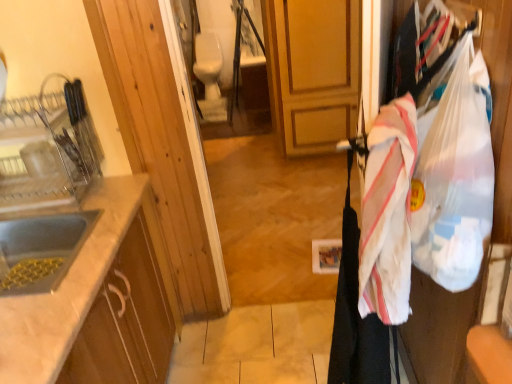
How much space does matte silver sink at left, which is counted as the 1th sink, starting from the top, occupy horizontally?

10.99 inches.

Locate an element on the screen. white marble countertop at left is located at coordinates (67, 290).

You are a GUI agent. You are given a task and a screenshot of the screen. Output one action in this format:
    pyautogui.click(x=<x>, y=<y>)
    Task: Click on the translucent plastic grocery bag at right
    
    Given the screenshot: What is the action you would take?
    pyautogui.click(x=454, y=176)

Can you confirm if matte silver sink at left, the 2th sink in the bottom-to-top sequence, is taller than translucent plastic grocery bag at right?

Incorrect, the height of matte silver sink at left, the 2th sink in the bottom-to-top sequence, is not larger of that of translucent plastic grocery bag at right.

Can you confirm if matte silver sink at left, the 2th sink in the bottom-to-top sequence, is positioned to the right of translucent plastic grocery bag at right?

In fact, matte silver sink at left, the 2th sink in the bottom-to-top sequence, is to the left of translucent plastic grocery bag at right.

There is a matte silver sink at left, the 2th sink in the bottom-to-top sequence. Where is `grocery bag above it (from a real-world perspective)`? The image size is (512, 384). grocery bag above it (from a real-world perspective) is located at coordinates (454, 176).

Is point (383, 160) farther from viewer compared to point (481, 206)?

Yes, point (383, 160) is behind point (481, 206).

Is white striped fabric at right not inside translucent plastic grocery bag at right?

Yes.

From a real-world perspective, which object rests below the other?

In real-world perspective, white striped fabric at right is lower.

In the image, is white striped fabric at right positioned in front of or behind translucent plastic grocery bag at right?

white striped fabric at right is positioned farther from the viewer than translucent plastic grocery bag at right.

Considering the sizes of objects white matte sink at left, the 1th sink positioned from the bottom, and white marble countertop at left in the image provided, who is bigger, white matte sink at left, the 1th sink positioned from the bottom, or white marble countertop at left?

With larger size is white marble countertop at left.

From a real-world perspective, is white matte sink at left, the 1th sink positioned from the bottom, above or below white marble countertop at left?

From a real-world perspective, white matte sink at left, the 1th sink positioned from the bottom, is physically above white marble countertop at left.

Measure the distance from white matte sink at left, the 1th sink positioned from the bottom, to white marble countertop at left.

white matte sink at left, the 1th sink positioned from the bottom, is 6.45 inches away from white marble countertop at left.

Is the surface of white matte sink at left, the 1th sink positioned from the bottom, in direct contact with white marble countertop at left?

No, white matte sink at left, the 1th sink positioned from the bottom, is not with white marble countertop at left.

Is white matte sink at left, the 1th sink positioned from the bottom, looking in the opposite direction of matte silver sink at left, the 2th sink in the bottom-to-top sequence?

No, white matte sink at left, the 1th sink positioned from the bottom, is not facing the opposite direction of matte silver sink at left, the 2th sink in the bottom-to-top sequence.

Between white matte sink at left, which is the 2th sink from top to bottom, and matte silver sink at left, which is counted as the 1th sink, starting from the top, which one appears on the right side from the viewer's perspective?

From the viewer's perspective, white matte sink at left, which is the 2th sink from top to bottom, appears more on the right side.

Considering the sizes of objects white matte sink at left, which is the 2th sink from top to bottom, and matte silver sink at left, the 2th sink in the bottom-to-top sequence, in the image provided, who is taller, white matte sink at left, which is the 2th sink from top to bottom, or matte silver sink at left, the 2th sink in the bottom-to-top sequence,?

matte silver sink at left, the 2th sink in the bottom-to-top sequence.

From a real-world perspective, who is located lower, white matte sink at left, the 1th sink positioned from the bottom, or matte silver sink at left, which is counted as the 1th sink, starting from the top?

white matte sink at left, the 1th sink positioned from the bottom, is physically lower.

Based on the photo, is white marble countertop at left at the back of white striped fabric at right?

white striped fabric at right is not turned away from white marble countertop at left.

Where is `countertop on the left of white striped fabric at right`? The width and height of the screenshot is (512, 384). countertop on the left of white striped fabric at right is located at coordinates (67, 290).

Considering the positions of point (395, 183) and point (42, 365), is point (395, 183) closer or farther from the camera than point (42, 365)?

Point (395, 183) is positioned farther from the camera compared to point (42, 365).

Is white striped fabric at right behind white marble countertop at left?

No, it is in front of white marble countertop at left.

Starting from the translucent plastic grocery bag at right, which sink is the 1st one behind? Please provide its 2D coordinates.

[(41, 250)]

Is white matte sink at left, the 1th sink positioned from the bottom, closer to the viewer compared to translucent plastic grocery bag at right?

No, white matte sink at left, the 1th sink positioned from the bottom, is further to the viewer.

How different are the orientations of white matte sink at left, which is the 2th sink from top to bottom, and translucent plastic grocery bag at right in degrees?

They differ by 176 degrees in their facing directions.

Could you tell me if white matte sink at left, which is the 2th sink from top to bottom, is turned towards translucent plastic grocery bag at right?

No, white matte sink at left, which is the 2th sink from top to bottom, is not turned towards translucent plastic grocery bag at right.

Considering the sizes of objects translucent plastic grocery bag at right and matte silver sink at left, the 2th sink in the bottom-to-top sequence, in the image provided, who is taller, translucent plastic grocery bag at right or matte silver sink at left, the 2th sink in the bottom-to-top sequence,?

translucent plastic grocery bag at right.

Would you say translucent plastic grocery bag at right is inside or outside matte silver sink at left, which is counted as the 1th sink, starting from the top?

translucent plastic grocery bag at right exists outside the volume of matte silver sink at left, which is counted as the 1th sink, starting from the top.

From the image's perspective, is translucent plastic grocery bag at right above or below matte silver sink at left, the 2th sink in the bottom-to-top sequence?

translucent plastic grocery bag at right is below matte silver sink at left, the 2th sink in the bottom-to-top sequence.

Where is `grocery bag lying on the right of matte silver sink at left, the 2th sink in the bottom-to-top sequence`? Image resolution: width=512 pixels, height=384 pixels. grocery bag lying on the right of matte silver sink at left, the 2th sink in the bottom-to-top sequence is located at coordinates (454, 176).

Locate an element on the screen. The height and width of the screenshot is (384, 512). the 2nd sink to the left when counting from the translucent plastic grocery bag at right is located at coordinates [x=47, y=152].

Find the location of a particular element. The image size is (512, 384). grocery bag above the white striped fabric at right (from the image's perspective) is located at coordinates [454, 176].

When comparing their distances from white marble countertop at left, does translucent plastic grocery bag at right or white matte sink at left, the 1th sink positioned from the bottom, seem further?

translucent plastic grocery bag at right is further to white marble countertop at left.

When comparing their distances from white striped fabric at right, does white marble countertop at left or white matte sink at left, which is the 2th sink from top to bottom, seem closer?

Among the two, white marble countertop at left is located nearer to white striped fabric at right.

Estimate the real-world distances between objects in this image. Which object is closer to translucent plastic grocery bag at right, matte silver sink at left, the 2th sink in the bottom-to-top sequence, or white matte sink at left, which is the 2th sink from top to bottom?

The object closer to translucent plastic grocery bag at right is white matte sink at left, which is the 2th sink from top to bottom.

Based on the photo, from the image, which object appears to be farther from white marble countertop at left, matte silver sink at left, which is counted as the 1th sink, starting from the top, or white striped fabric at right?

Among the two, white striped fabric at right is located further to white marble countertop at left.

When comparing their distances from white matte sink at left, which is the 2th sink from top to bottom, does translucent plastic grocery bag at right or white marble countertop at left seem further?

translucent plastic grocery bag at right.

When comparing their distances from matte silver sink at left, the 2th sink in the bottom-to-top sequence, does translucent plastic grocery bag at right or white striped fabric at right seem further?

translucent plastic grocery bag at right.

When comparing their distances from matte silver sink at left, which is counted as the 1th sink, starting from the top, does white striped fabric at right or translucent plastic grocery bag at right seem closer?

white striped fabric at right.

Which object lies nearer to the anchor point white striped fabric at right, white marble countertop at left or matte silver sink at left, which is counted as the 1th sink, starting from the top?

white marble countertop at left.

Image resolution: width=512 pixels, height=384 pixels. Identify the location of sink between matte silver sink at left, which is counted as the 1th sink, starting from the top, and white striped fabric at right from left to right. (41, 250).

This screenshot has width=512, height=384. What are the coordinates of `sink between matte silver sink at left, which is counted as the 1th sink, starting from the top, and white marble countertop at left from top to bottom` in the screenshot? It's located at (41, 250).

The width and height of the screenshot is (512, 384). Find the location of `countertop between matte silver sink at left, the 2th sink in the bottom-to-top sequence, and translucent plastic grocery bag at right, in the horizontal direction`. countertop between matte silver sink at left, the 2th sink in the bottom-to-top sequence, and translucent plastic grocery bag at right, in the horizontal direction is located at coordinates (67, 290).

Where is `blanket between white matte sink at left, the 1th sink positioned from the bottom, and translucent plastic grocery bag at right, in the horizontal direction`? blanket between white matte sink at left, the 1th sink positioned from the bottom, and translucent plastic grocery bag at right, in the horizontal direction is located at coordinates (388, 213).